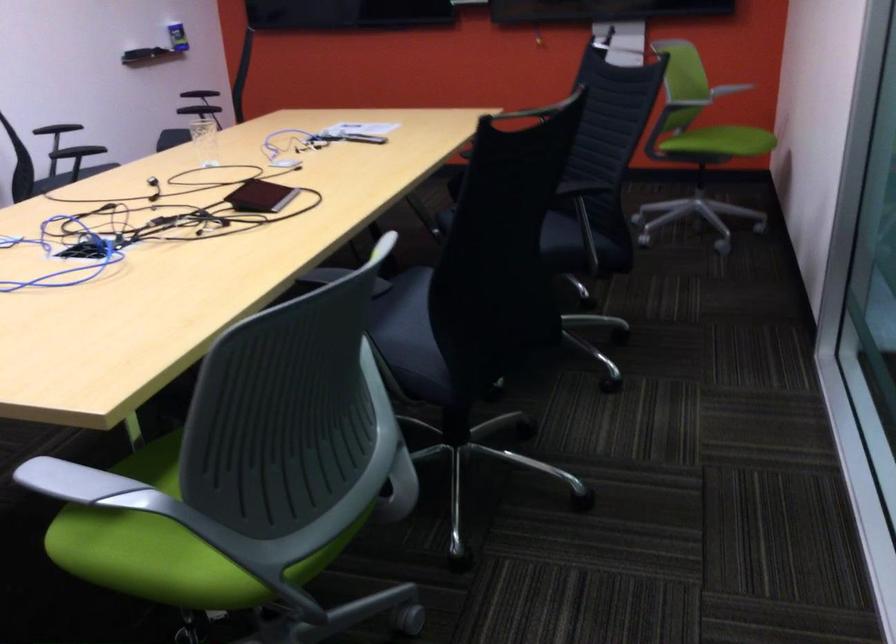
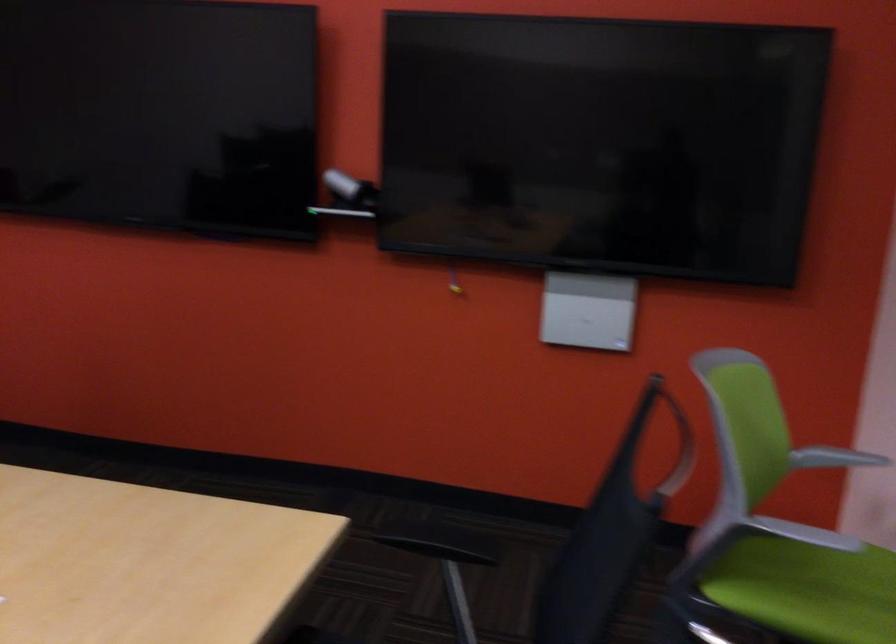
Question: Which direction would the cameraman need to move to produce the second image? Reply with the corresponding letter.

Choices:
 (A) Left
 (B) Right
 (C) Forward
 (D) Backward

Answer: (C)